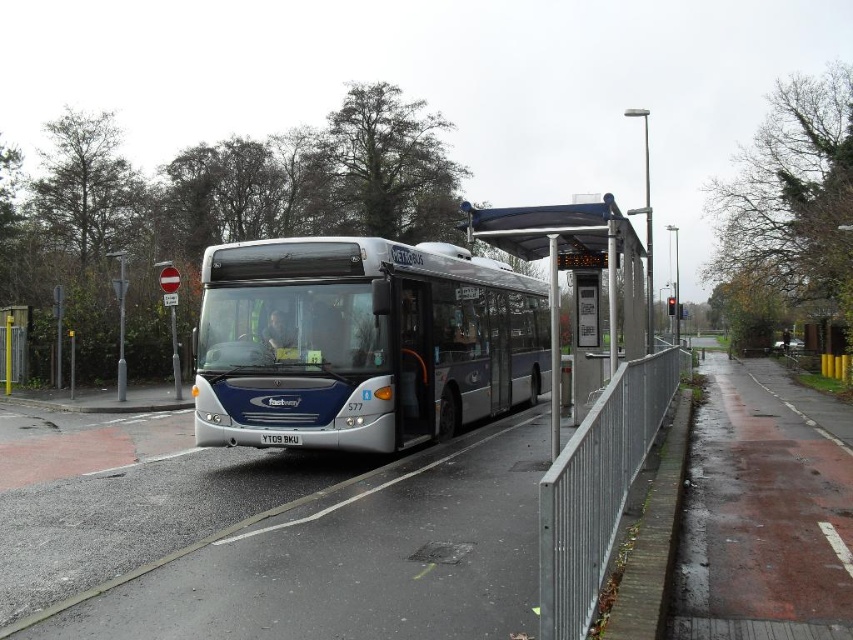
Consider the image. Does silver metallic bus at center lie behind transparent plastic bus stop at center?

That is True.

Who is lower down, silver metallic bus at center or transparent plastic bus stop at center?

silver metallic bus at center is lower down.

Between point (303, 259) and point (637, 256), which one is positioned behind?

The point (637, 256) is more distant.

You are a GUI agent. You are given a task and a screenshot of the screen. Output one action in this format:
    pyautogui.click(x=<x>, y=<y>)
    Task: Click on the silver metallic bus at center
    The image size is (853, 640).
    Given the screenshot: What is the action you would take?
    pyautogui.click(x=360, y=342)

Who is higher up, silver metallic fence at right or transparent plastic bus stop at center?

Positioned higher is transparent plastic bus stop at center.

Between point (628, 404) and point (643, 324), which one is positioned behind?

The point (643, 324) is more distant.

The height and width of the screenshot is (640, 853). Identify the location of silver metallic fence at right. (598, 488).

Is silver metallic bus at center thinner than silver metallic fence at right?

No.

Does point (199, 387) lie behind point (558, 465)?

Yes, it is behind point (558, 465).

The height and width of the screenshot is (640, 853). I want to click on silver metallic bus at center, so click(x=360, y=342).